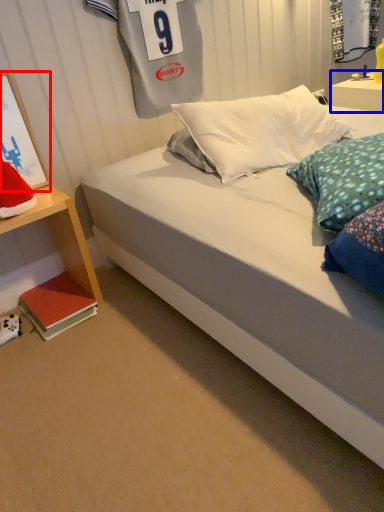
Question: Among these objects, which one is farthest to the camera, picture frame (highlighted by a red box) or nightstand (highlighted by a blue box)?

Choices:
 (A) picture frame
 (B) nightstand

Answer: (B)